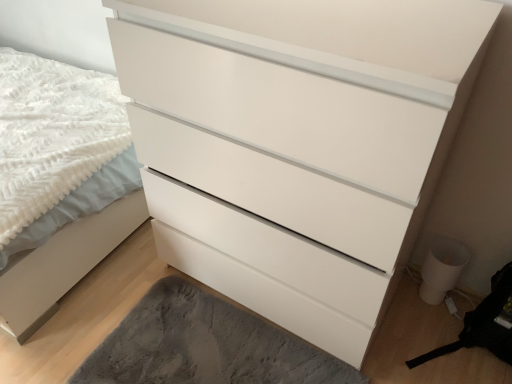
You are a GUI agent. You are given a task and a screenshot of the screen. Output one action in this format:
    pyautogui.click(x=<x>, y=<y>)
    Task: Click on the white matte bed at lower left
    This screenshot has height=384, width=512.
    Given the screenshot: What is the action you would take?
    pyautogui.click(x=60, y=182)

What do you see at coordinates (60, 182) in the screenshot? Image resolution: width=512 pixels, height=384 pixels. I see `white matte bed at lower left` at bounding box center [60, 182].

Where is `white matte bed at lower left`? The image size is (512, 384). white matte bed at lower left is located at coordinates (60, 182).